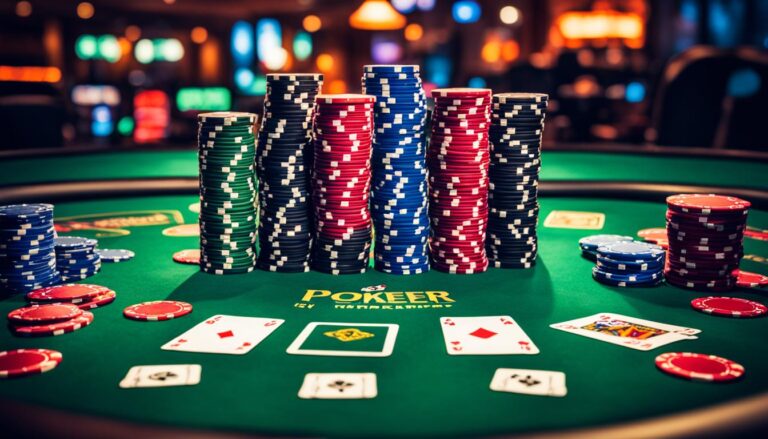
This screenshot has height=439, width=768. Find the location of `playing cards`. playing cards is located at coordinates (226, 326), (484, 338), (623, 331), (657, 348).